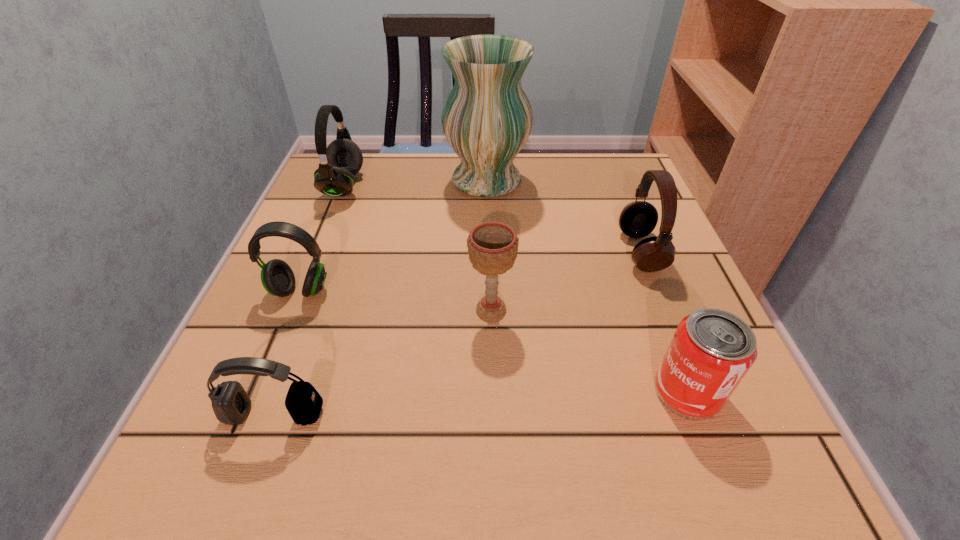
This screenshot has width=960, height=540. I want to click on vacant area situated on the ear pads of the rightmost headset, so click(417, 251).

Where is `free region located 0.290m on the right of the chalice`? free region located 0.290m on the right of the chalice is located at coordinates (684, 310).

The height and width of the screenshot is (540, 960). Find the location of `free point located 0.130m on the left of the can`. free point located 0.130m on the left of the can is located at coordinates (564, 392).

What are the coordinates of `vase located at the far edge` in the screenshot? It's located at (487, 118).

Find the location of a particular element. Image resolution: width=960 pixels, height=540 pixels. headset present at the far edge is located at coordinates (x=339, y=162).

The width and height of the screenshot is (960, 540). I want to click on object that is at the near edge, so click(x=231, y=404).

Where is `headset that is at the right edge`? Image resolution: width=960 pixels, height=540 pixels. headset that is at the right edge is located at coordinates (638, 219).

The width and height of the screenshot is (960, 540). Find the location of `can at the right edge`. can at the right edge is located at coordinates (712, 350).

Locate an element on the screen. This screenshot has width=960, height=540. object located at the far left corner is located at coordinates (339, 162).

Find the location of a particular element. object that is at the near left corner is located at coordinates (231, 404).